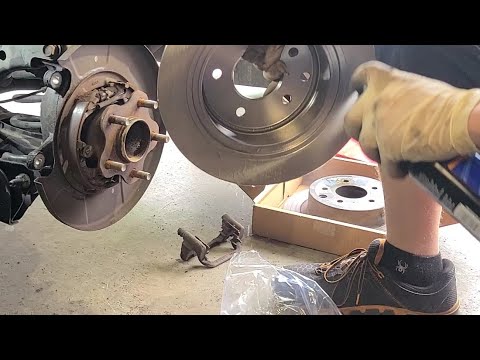
This screenshot has width=480, height=360. Identify the location of box. (285, 225).